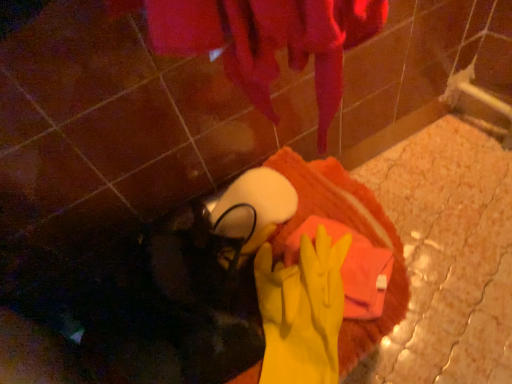
The height and width of the screenshot is (384, 512). Identify the location of yellow rubber glove at center. (302, 311).

The height and width of the screenshot is (384, 512). What do you see at coordinates (302, 311) in the screenshot?
I see `yellow rubber glove at center` at bounding box center [302, 311].

I want to click on yellow rubber glove at center, so click(x=302, y=311).